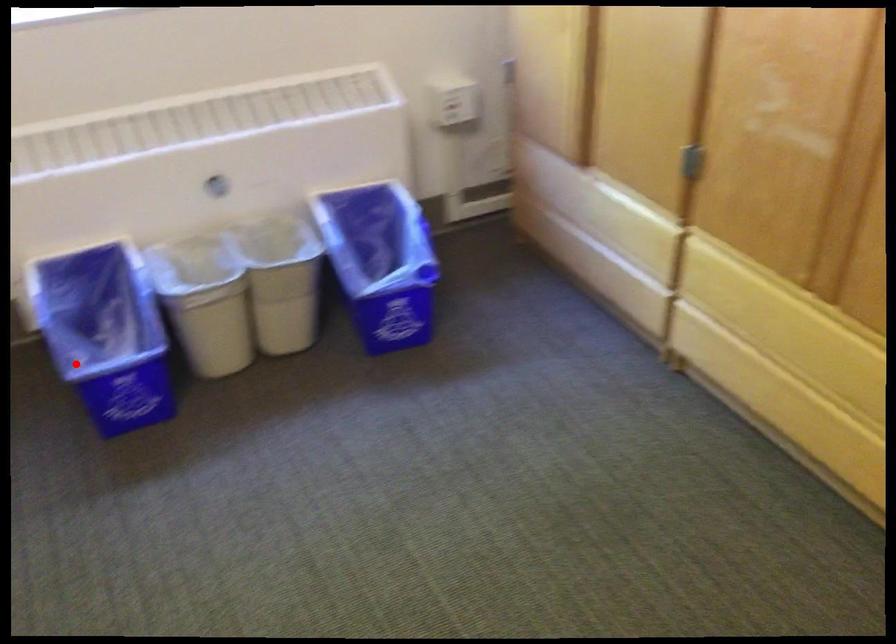
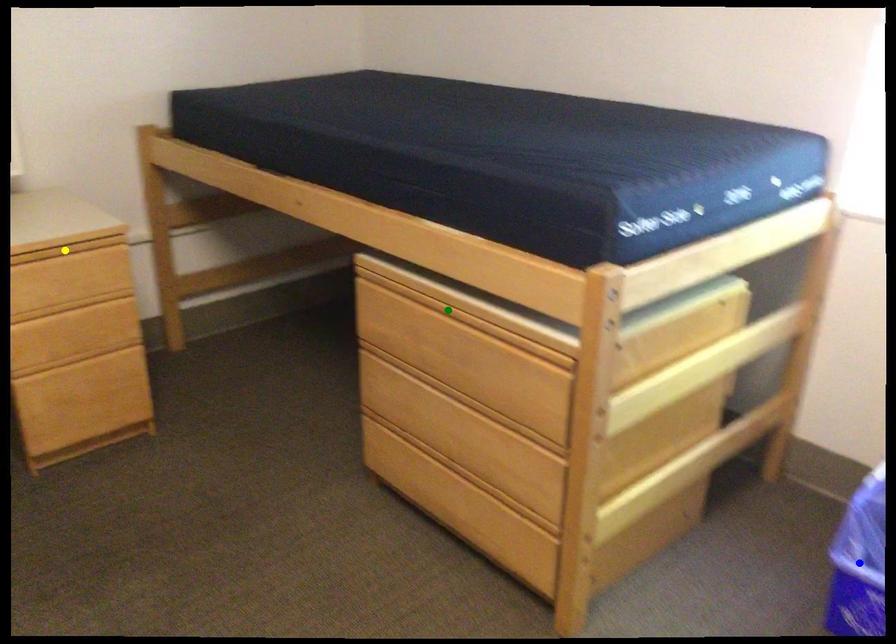
Question: I am providing you with two images of the same scene from different viewpoints. A red point is marked on the first image. You are given multiple points on the second image. Which mark in image 2 goes with the point in image 1?

Choices:
 (A) yellow point
 (B) green point
 (C) blue point

Answer: (C)